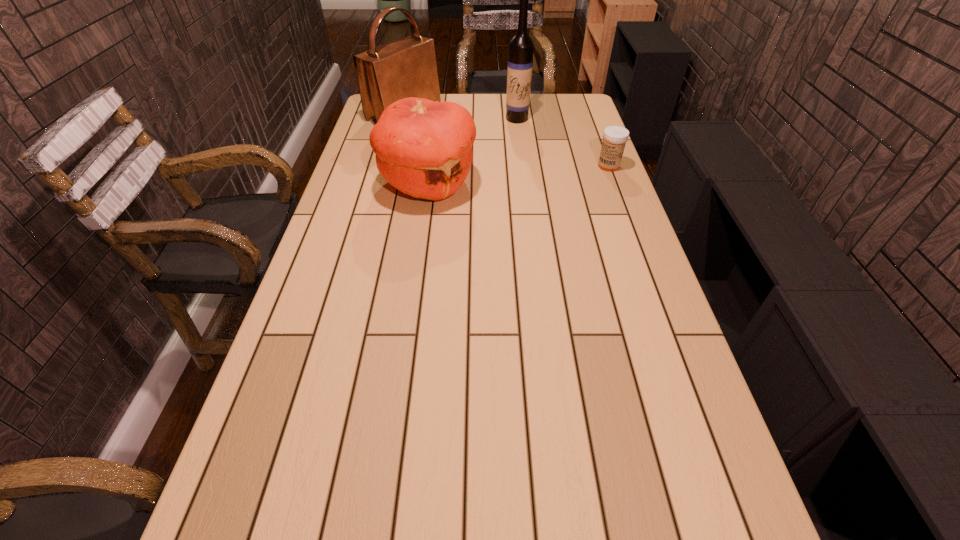
Identify the location of free space between the rightmost object and the third object from left to right. This screenshot has width=960, height=540. (563, 142).

Identify which object is located as the third nearest to the third tallest object. Please provide its 2D coordinates. Your answer should be formatted as a tuple, i.e. [(x, y)], where the tuple contains the x and y coordinates of a point satisfying the conditions above.

[(614, 137)]

I want to click on object identified as the second closest to the third object from left to right, so click(x=423, y=148).

At what (x,y) coordinates should I click in order to perform the action: click on vacant space that satisfies the following two spatial constraints: 1. on the front side of the second object from right to left; 2. on the right side of the third shortest object. Please return your answer as a coordinate pair (x, y). Looking at the image, I should click on (403, 118).

Find the location of a particular element. free space that satisfies the following two spatial constraints: 1. on the front side of the second tallest object; 2. on the left side of the rightmost object is located at coordinates (392, 166).